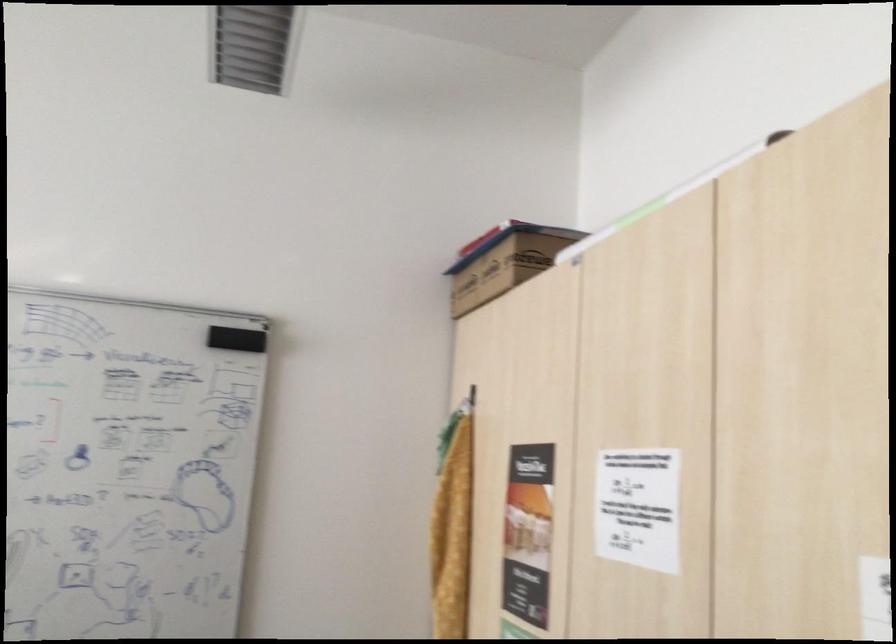
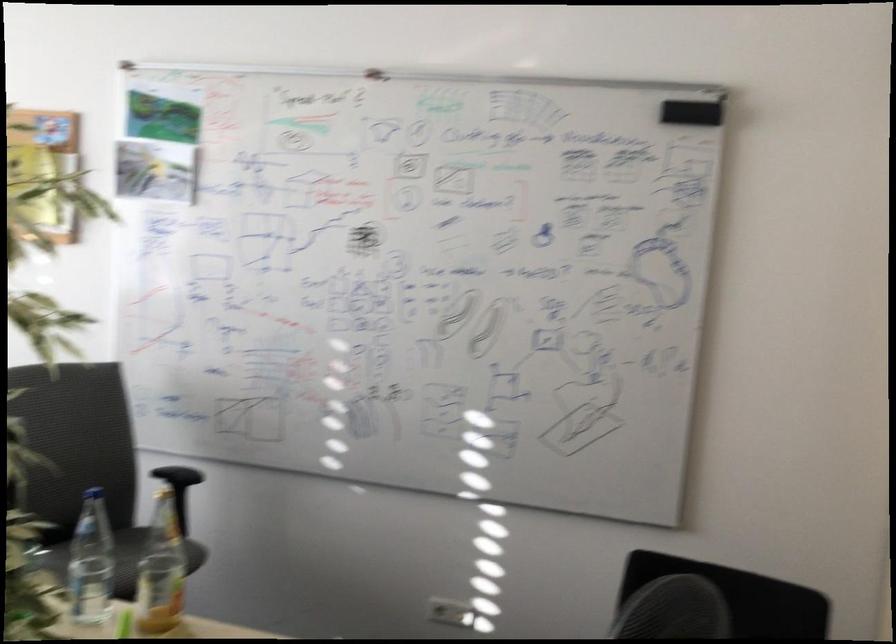
Question: The camera is either moving clockwise (left) or counter-clockwise (right) around the object. The first image is from the beginning of the video and the second image is from the end. Is the camera moving left or right when shooting the video?

Choices:
 (A) Left
 (B) Right

Answer: (B)